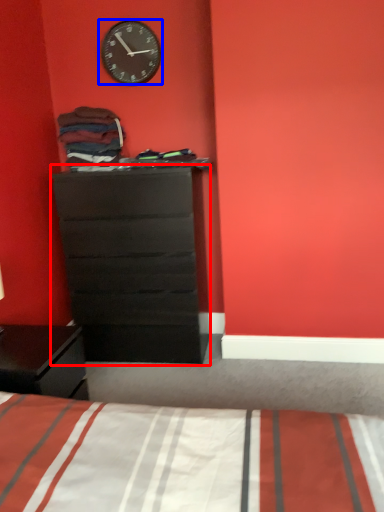
Question: Among these objects, which one is nearest to the camera, chest of drawers (highlighted by a red box) or wall clock (highlighted by a blue box)?

Choices:
 (A) chest of drawers
 (B) wall clock

Answer: (A)